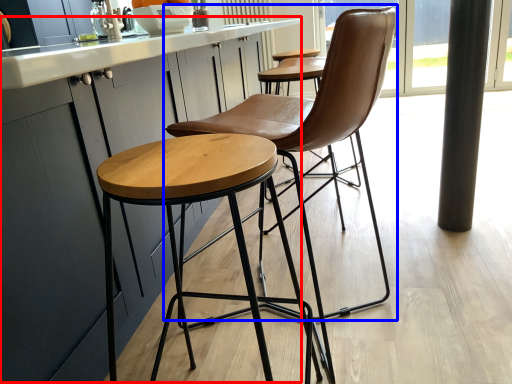
Question: Which object appears closest to the camera in this image, counter top (highlighted by a red box) or chair (highlighted by a blue box)?

Choices:
 (A) counter top
 (B) chair

Answer: (A)